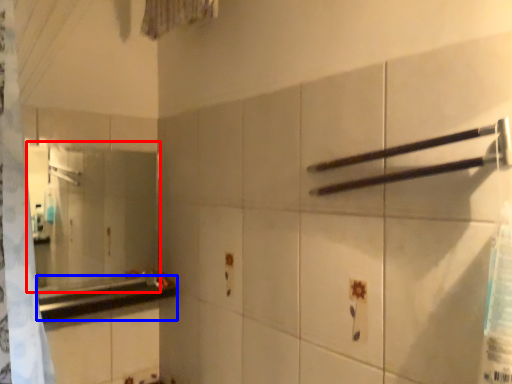
Question: Among these objects, which one is nearest to the camera, mirror (highlighted by a red box) or counter top (highlighted by a blue box)?

Choices:
 (A) mirror
 (B) counter top

Answer: (B)